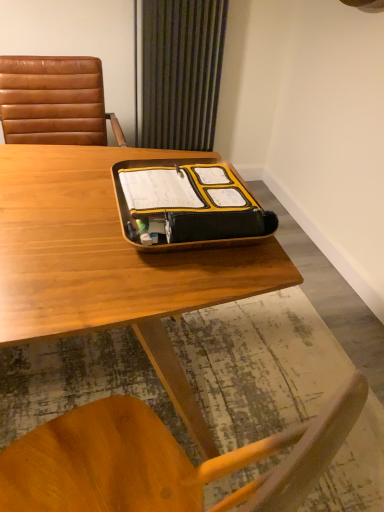
The width and height of the screenshot is (384, 512). What are the coordinates of `free space to the left of yellow matte tray at center` in the screenshot? It's located at (60, 195).